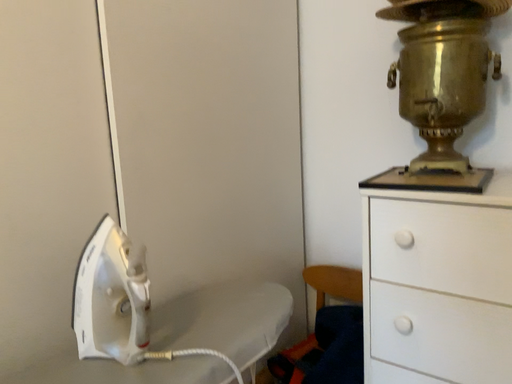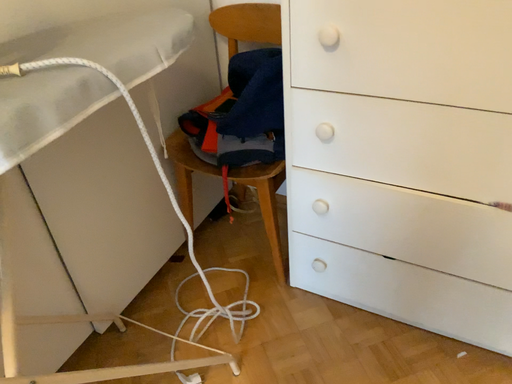
Question: How did the camera likely rotate when shooting the video?

Choices:
 (A) rotated right
 (B) rotated left

Answer: (A)